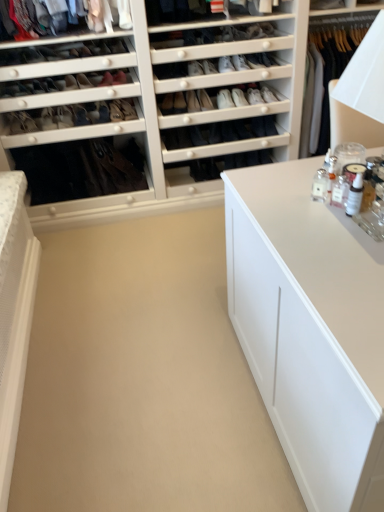
Question: Is matte black shoe at center, which appears as the 7th shoe when viewed from the right, shorter than white matte cabinet at center?

Choices:
 (A) no
 (B) yes

Answer: (A)

Question: Considering the relative positions of matte black shoe at center, which ranks as the third shoe in left-to-right order, and white matte cabinet at center in the image provided, is matte black shoe at center, which ranks as the third shoe in left-to-right order, to the left of white matte cabinet at center from the viewer's perspective?

Choices:
 (A) no
 (B) yes

Answer: (B)

Question: From the image's perspective, is matte black shoe at center, which ranks as the third shoe in left-to-right order, above white matte cabinet at center?

Choices:
 (A) no
 (B) yes

Answer: (B)

Question: Does matte black shoe at center, which ranks as the third shoe in left-to-right order, come behind white matte cabinet at center?

Choices:
 (A) yes
 (B) no

Answer: (A)

Question: Does matte black shoe at center, which appears as the 7th shoe when viewed from the right, have a smaller size compared to white matte cabinet at center?

Choices:
 (A) no
 (B) yes

Answer: (B)

Question: Can you confirm if matte black shoe at center, which ranks as the third shoe in left-to-right order, is taller than white matte cabinet at center?

Choices:
 (A) yes
 (B) no

Answer: (A)

Question: Is matte black shoe at center, which appears as the 7th shoe when viewed from the right, taller than matte black shoe at center, which is counted as the 5th shoe, starting from the right?

Choices:
 (A) no
 (B) yes

Answer: (A)

Question: Is matte black shoe at center, which ranks as the third shoe in left-to-right order, outside of matte black shoe at center, which is counted as the 5th shoe, starting from the right?

Choices:
 (A) no
 (B) yes

Answer: (B)

Question: Is matte black shoe at center, which ranks as the third shoe in left-to-right order, looking in the opposite direction of matte black shoe at center, which is counted as the 5th shoe, starting from the right?

Choices:
 (A) yes
 (B) no

Answer: (B)

Question: Does matte black shoe at center, which appears as the 7th shoe when viewed from the right, have a smaller size compared to matte black shoe at center, positioned as the 5th shoe in left-to-right order?

Choices:
 (A) yes
 (B) no

Answer: (B)

Question: Considering the relative positions of matte black shoe at center, which ranks as the third shoe in left-to-right order, and matte black shoe at center, positioned as the 5th shoe in left-to-right order, in the image provided, is matte black shoe at center, which ranks as the third shoe in left-to-right order, to the left of matte black shoe at center, positioned as the 5th shoe in left-to-right order, from the viewer's perspective?

Choices:
 (A) no
 (B) yes

Answer: (B)

Question: Considering the relative sizes of matte black shoe at center, which ranks as the third shoe in left-to-right order, and matte black shoe at center, which is counted as the 5th shoe, starting from the right, in the image provided, is matte black shoe at center, which ranks as the third shoe in left-to-right order, wider than matte black shoe at center, which is counted as the 5th shoe, starting from the right,?

Choices:
 (A) no
 (B) yes

Answer: (B)

Question: Can you confirm if matte black shoe at center, which is counted as the 5th shoe, starting from the right, is bigger than matte black shoe at center, the 7th shoe from the left?

Choices:
 (A) yes
 (B) no

Answer: (A)